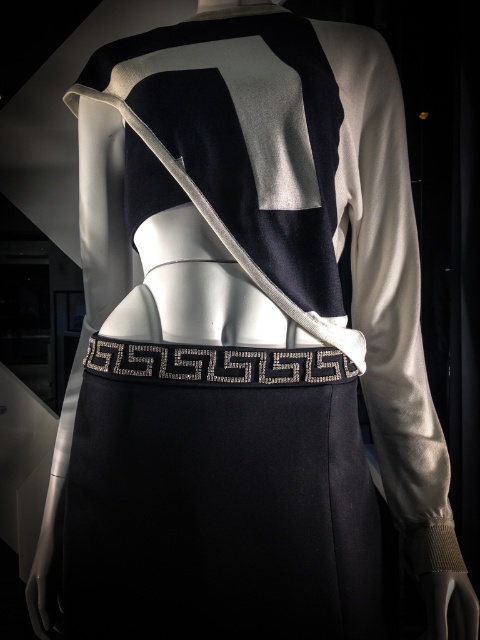
Question: Which object is closer to the camera taking this photo?

Choices:
 (A) black satin apron at center
 (B) silver metallic belt at center

Answer: (A)

Question: Which point is closer to the camera?

Choices:
 (A) silver metallic belt at center
 (B) black satin apron at center

Answer: (B)

Question: Which object appears closest to the camera in this image?

Choices:
 (A) black satin apron at center
 (B) silver metallic belt at center

Answer: (A)

Question: Is black satin apron at center behind silver metallic belt at center?

Choices:
 (A) no
 (B) yes

Answer: (A)

Question: Considering the relative positions of black satin apron at center and silver metallic belt at center in the image provided, where is black satin apron at center located with respect to silver metallic belt at center?

Choices:
 (A) left
 (B) right

Answer: (B)

Question: Is black satin apron at center further to camera compared to silver metallic belt at center?

Choices:
 (A) no
 (B) yes

Answer: (A)